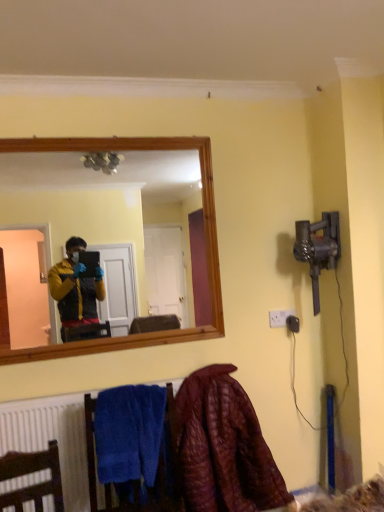
Question: Considering the relative sizes of velvet maroon blanket at lower right and white plastic electric outlet at lower right in the image provided, is velvet maroon blanket at lower right shorter than white plastic electric outlet at lower right?

Choices:
 (A) no
 (B) yes

Answer: (A)

Question: Is velvet maroon blanket at lower right smaller than white plastic electric outlet at lower right?

Choices:
 (A) yes
 (B) no

Answer: (B)

Question: Are velvet maroon blanket at lower right and white plastic electric outlet at lower right far apart?

Choices:
 (A) no
 (B) yes

Answer: (A)

Question: Considering the relative sizes of velvet maroon blanket at lower right and white plastic electric outlet at lower right in the image provided, is velvet maroon blanket at lower right bigger than white plastic electric outlet at lower right?

Choices:
 (A) no
 (B) yes

Answer: (B)

Question: Does velvet maroon blanket at lower right lie in front of white plastic electric outlet at lower right?

Choices:
 (A) no
 (B) yes

Answer: (B)

Question: From the image's perspective, is velvet maroon blanket at lower right above or below blue soft towel at lower left?

Choices:
 (A) above
 (B) below

Answer: (B)

Question: From a real-world perspective, is velvet maroon blanket at lower right physically located above or below blue soft towel at lower left?

Choices:
 (A) below
 (B) above

Answer: (A)

Question: Considering their positions, is velvet maroon blanket at lower right located in front of or behind blue soft towel at lower left?

Choices:
 (A) front
 (B) behind

Answer: (B)

Question: In terms of size, does velvet maroon blanket at lower right appear bigger or smaller than blue soft towel at lower left?

Choices:
 (A) small
 (B) big

Answer: (B)

Question: From a real-world perspective, relative to white plastic electric outlet at lower right, is velvet maroon blanket at lower right vertically above or below?

Choices:
 (A) above
 (B) below

Answer: (B)

Question: Considering the positions of velvet maroon blanket at lower right and white plastic electric outlet at lower right in the image, is velvet maroon blanket at lower right bigger or smaller than white plastic electric outlet at lower right?

Choices:
 (A) small
 (B) big

Answer: (B)

Question: Does point (196, 402) appear closer or farther from the camera than point (279, 322)?

Choices:
 (A) closer
 (B) farther

Answer: (A)

Question: Choose the correct answer: Is velvet maroon blanket at lower right inside white plastic electric outlet at lower right or outside it?

Choices:
 (A) outside
 (B) inside

Answer: (A)

Question: In terms of size, does white plastic electric outlet at lower right appear bigger or smaller than blue soft towel at lower left?

Choices:
 (A) small
 (B) big

Answer: (A)

Question: Looking at their shapes, would you say white plastic electric outlet at lower right is wider or thinner than blue soft towel at lower left?

Choices:
 (A) thin
 (B) wide

Answer: (A)